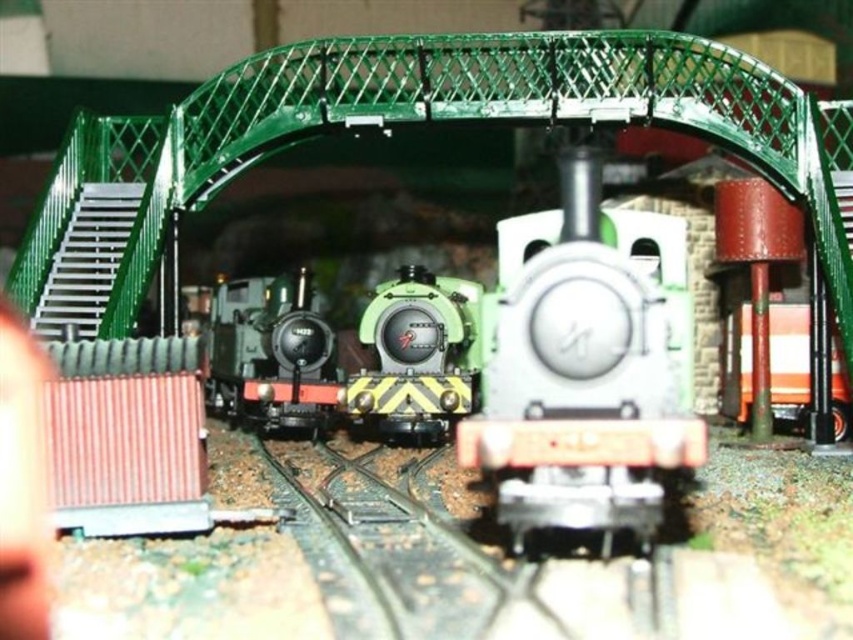
Which of these two, metallic green train at center or green matte train at center, stands shorter?

green matte train at center

Can you confirm if metallic green train at center is shorter than green matte train at center?

No.

I want to click on metallic green train at center, so pos(579,381).